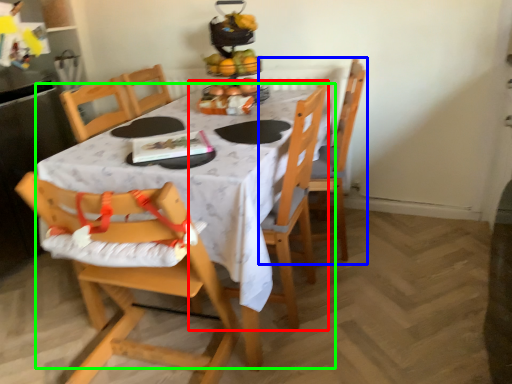
Question: Which object is positioned farthest from chair (highlighted by a red box)? Select from chair (highlighted by a blue box) and table (highlighted by a green box).

Choices:
 (A) chair
 (B) table

Answer: (A)